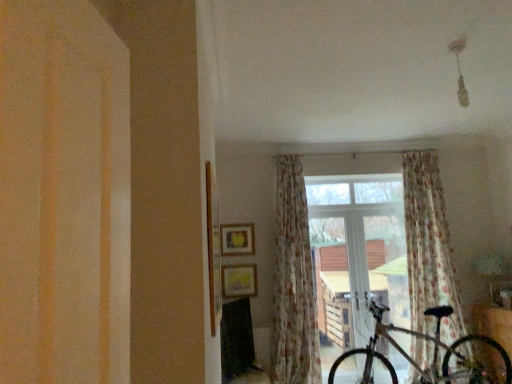
Question: Is floral fabric curtain at center, the 1th curtain viewed from the right, placed right next to transparent glass window at center?

Choices:
 (A) no
 (B) yes

Answer: (A)

Question: Can you confirm if floral fabric curtain at center, arranged as the second curtain when viewed from the left, is positioned to the right of transparent glass window at center?

Choices:
 (A) yes
 (B) no

Answer: (A)

Question: Is floral fabric curtain at center, arranged as the second curtain when viewed from the left, not within transparent glass window at center?

Choices:
 (A) no
 (B) yes

Answer: (B)

Question: Is floral fabric curtain at center, arranged as the second curtain when viewed from the left, at the left side of transparent glass window at center?

Choices:
 (A) no
 (B) yes

Answer: (A)

Question: Can you confirm if floral fabric curtain at center, the 1th curtain viewed from the right, is smaller than transparent glass window at center?

Choices:
 (A) yes
 (B) no

Answer: (B)

Question: In terms of size, does transparent glass window at center appear bigger or smaller than floral fabric curtain at center, marked as the 2th curtain in a right-to-left arrangement?

Choices:
 (A) big
 (B) small

Answer: (B)

Question: Is transparent glass window at center in front of or behind floral fabric curtain at center, acting as the 1th curtain starting from the left, in the image?

Choices:
 (A) behind
 (B) front

Answer: (A)

Question: In the image, is transparent glass window at center on the left side or the right side of floral fabric curtain at center, marked as the 2th curtain in a right-to-left arrangement?

Choices:
 (A) left
 (B) right

Answer: (B)

Question: From a real-world perspective, relative to floral fabric curtain at center, marked as the 2th curtain in a right-to-left arrangement, is transparent glass window at center vertically above or below?

Choices:
 (A) above
 (B) below

Answer: (B)

Question: From the image's perspective, is transparent glass window at center above or below floral fabric curtain at center, the 1th curtain viewed from the right?

Choices:
 (A) below
 (B) above

Answer: (A)

Question: Is point (377, 349) closer or farther from the camera than point (451, 302)?

Choices:
 (A) farther
 (B) closer

Answer: (B)

Question: Is transparent glass window at center bigger or smaller than floral fabric curtain at center, the 1th curtain viewed from the right?

Choices:
 (A) big
 (B) small

Answer: (B)

Question: Is transparent glass window at center situated inside floral fabric curtain at center, arranged as the second curtain when viewed from the left, or outside?

Choices:
 (A) outside
 (B) inside

Answer: (A)

Question: Relative to floral fabric curtain at center, the 1th curtain viewed from the right, is floral fabric curtain at center, acting as the 1th curtain starting from the left, in front or behind?

Choices:
 (A) front
 (B) behind

Answer: (A)

Question: Do you think floral fabric curtain at center, acting as the 1th curtain starting from the left, is within floral fabric curtain at center, the 1th curtain viewed from the right, or outside of it?

Choices:
 (A) outside
 (B) inside

Answer: (A)